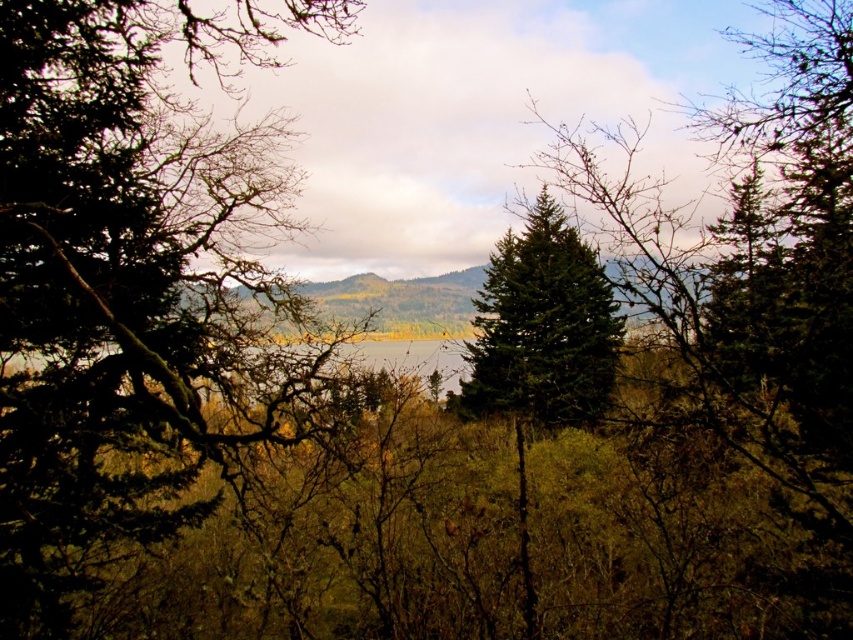
Does green matte pine at center have a larger size compared to green matte forest at center?

Indeed, green matte pine at center has a larger size compared to green matte forest at center.

The image size is (853, 640). Describe the element at coordinates (543, 326) in the screenshot. I see `green matte pine at center` at that location.

Locate an element on the screen. green matte pine at center is located at coordinates (543, 326).

This screenshot has width=853, height=640. I want to click on green matte pine at center, so click(x=543, y=326).

Does green matte tree at left have a smaller size compared to green matte pine at center?

Yes, green matte tree at left is smaller than green matte pine at center.

Is point (68, 428) farther from camera compared to point (596, 310)?

That is False.

The image size is (853, 640). What do you see at coordinates (132, 285) in the screenshot?
I see `green matte tree at left` at bounding box center [132, 285].

Where is `green matte tree at left`? green matte tree at left is located at coordinates (132, 285).

Is green matte tree at left behind green matte forest at center?

Yes, it is.

Between point (109, 516) and point (384, 298), which one is positioned in front?

Point (109, 516)

Identify the location of green matte tree at left. (132, 285).